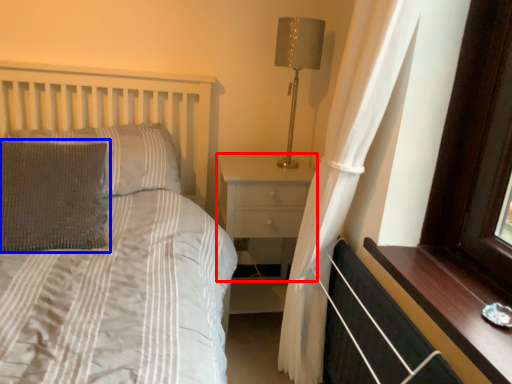
Question: Which point is further to the camera, nightstand (highlighted by a red box) or pillow (highlighted by a blue box)?

Choices:
 (A) nightstand
 (B) pillow

Answer: (A)